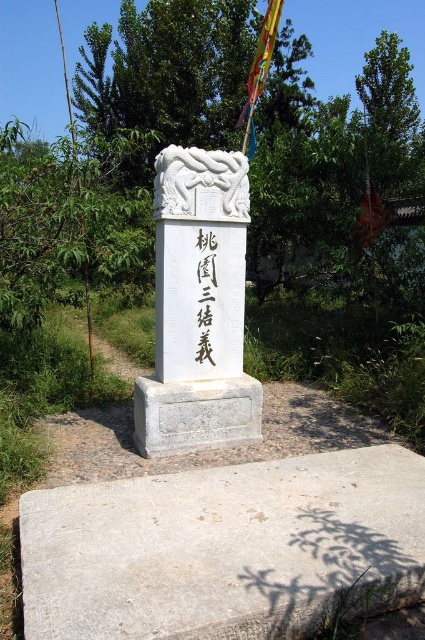
Question: Which point is closer to the camera taking this photo?

Choices:
 (A) (207, 243)
 (B) (248, 436)
 (C) (161, 422)
 (D) (155, 525)

Answer: (D)

Question: Is gray concrete at lower center bigger than white stone monument at center?

Choices:
 (A) yes
 (B) no

Answer: (A)

Question: Does gray concrete at lower center appear on the right side of gray stone base at center?

Choices:
 (A) no
 (B) yes

Answer: (B)

Question: Among these objects, which one is farthest from the camera?

Choices:
 (A) black stone writing at center
 (B) white stone monument at center
 (C) gray stone base at center

Answer: (A)

Question: Which object is the farthest from the black stone writing at center?

Choices:
 (A) gray concrete at lower center
 (B) white stone monument at center

Answer: (A)

Question: Considering the relative positions of white stone monument at center and gray stone base at center in the image provided, where is white stone monument at center located with respect to gray stone base at center?

Choices:
 (A) left
 (B) right

Answer: (B)